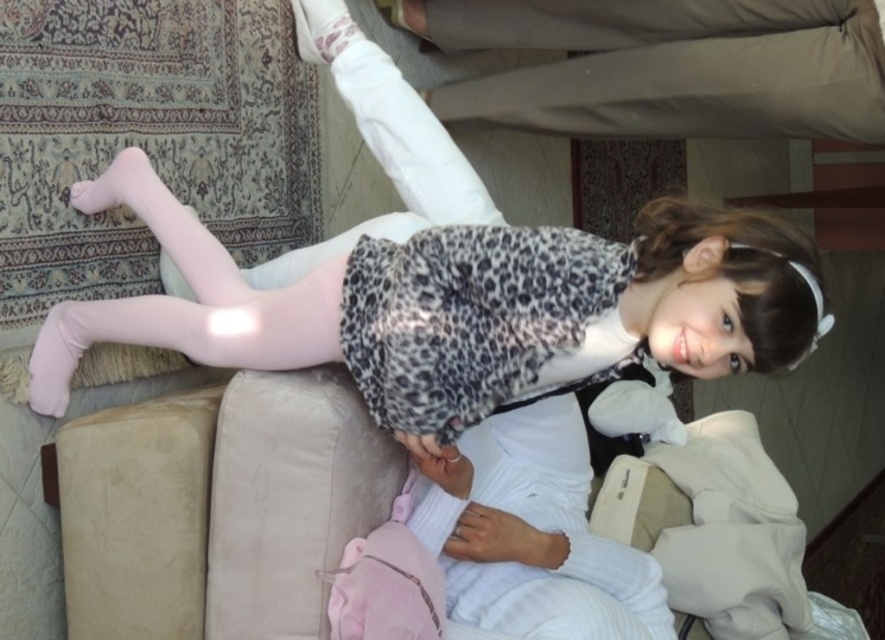
You are a photographer setting up a shoot in this room. You need to position a light source so it illuminates both the matte white tights at upper center and the beige cotton pants at upper center equally. Considering their positions, which object should be placed closer to the light source?

The matte white tights at upper center should be placed closer to the light source because it is closer to the viewer than the beige cotton pants at upper center, so to ensure equal illumination, the light source should be positioned closer to the matte white tights at upper center.

You are a photographer setting up a shoot in this room. You need to position a small stool between the matte white tights at upper center and the beige cotton pants at upper center. Based on their heights, which object should the stool be placed closer to?

The stool should be placed closer to the beige cotton pants at upper center because the matte white tights at upper center is much taller than the beige cotton pants at upper center, so the stool needs to compensate for the height difference to maintain balance.

You are standing in the room and want to place a small plant pot exactly at the center of the room. The center of the room is at point coordinates of 0.5, 0.5. Can you place the plant pot at the center of the room without it overlapping with the matte white tights at upper center?

The matte white tights at upper center is located at point coordinates of (458, 307), which is very close to the center of the room at (442, 320). The distance between them is minimal, so placing the plant pot exactly at the center might cause slight overlap. It would be better to adjust the position slightly to avoid overlapping with the matte white tights at upper center.